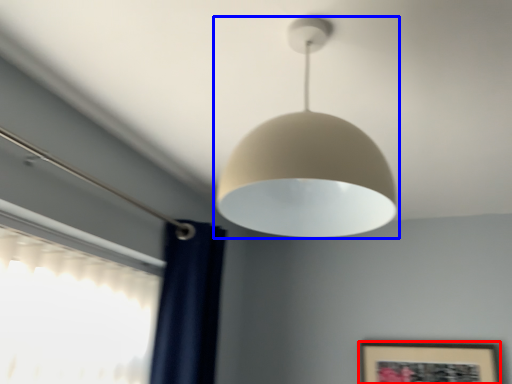
Question: Among these objects, which one is farthest to the camera, picture frame (highlighted by a red box) or lamp (highlighted by a blue box)?

Choices:
 (A) picture frame
 (B) lamp

Answer: (A)